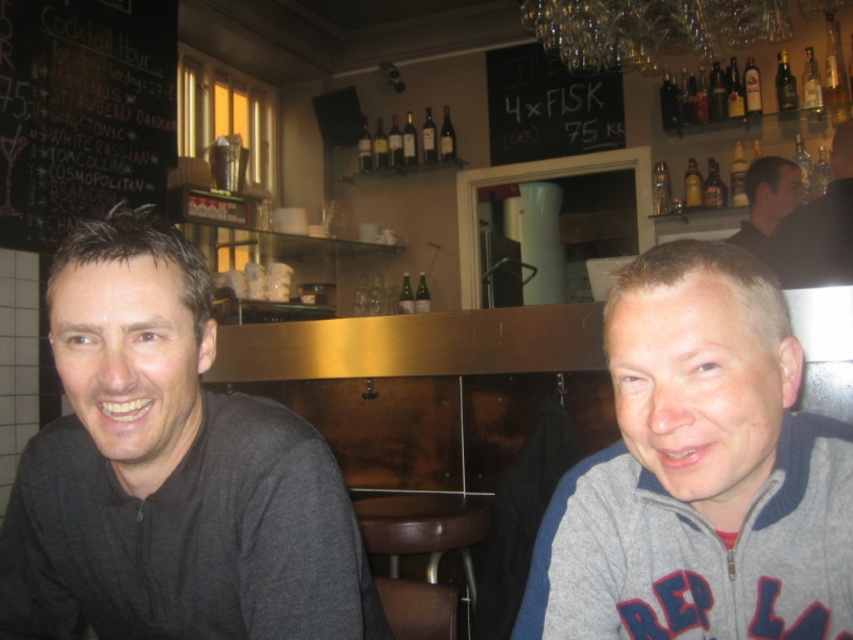
Question: Does gray fleece jacket at lower right have a smaller size compared to black chalkboard at upper left?

Choices:
 (A) yes
 (B) no

Answer: (A)

Question: Does brown leather stool at center appear over black leather jacket at upper right?

Choices:
 (A) yes
 (B) no

Answer: (B)

Question: Which object appears closest to the camera in this image?

Choices:
 (A) gray fleece jacket at lower right
 (B) dark brown leather jacket at upper right
 (C) gray zip-up jacket at left

Answer: (A)

Question: Which point is farther from the camera taking this photo?

Choices:
 (A) (471, 531)
 (B) (106, 324)
 (C) (804, 260)

Answer: (C)

Question: Which point is closer to the camera?

Choices:
 (A) dark brown leather jacket at upper right
 (B) brown leather stool at center
 (C) black chalkboard at upper left
 (D) gray zip-up jacket at left

Answer: (D)

Question: Is gray fleece jacket at lower right positioned in front of black chalkboard at upper left?

Choices:
 (A) yes
 (B) no

Answer: (A)